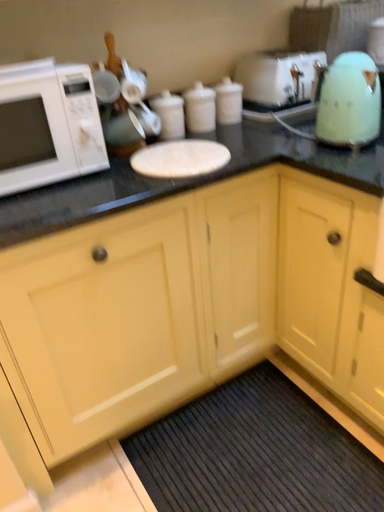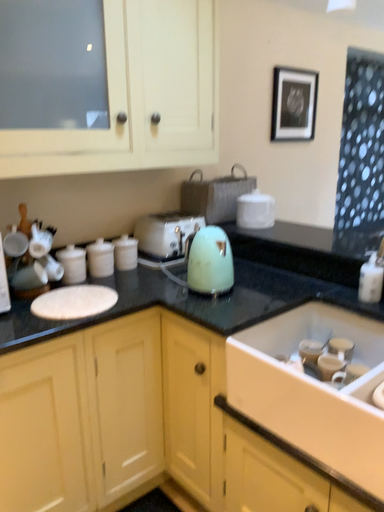
Question: Which way did the camera rotate in the video?

Choices:
 (A) rotated left
 (B) rotated right

Answer: (B)